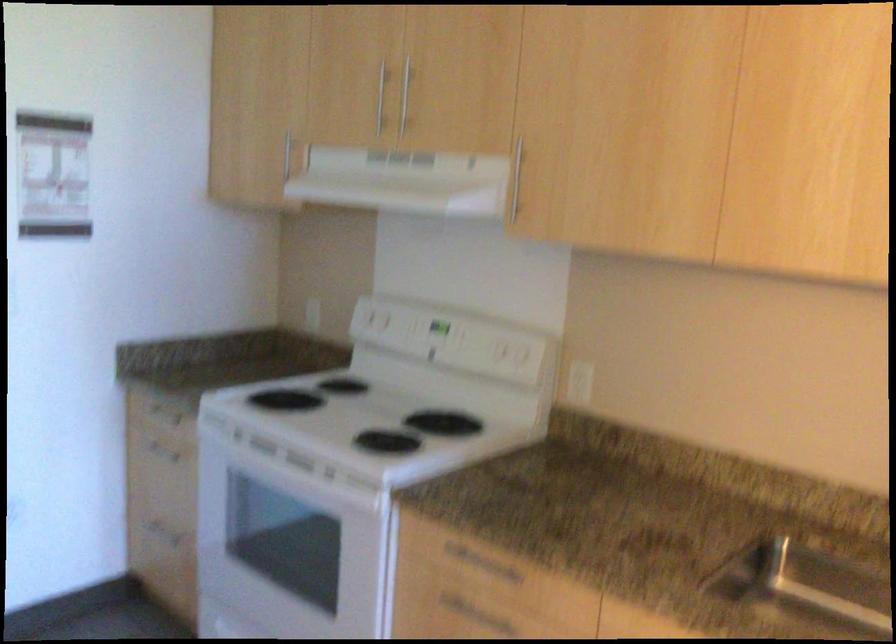
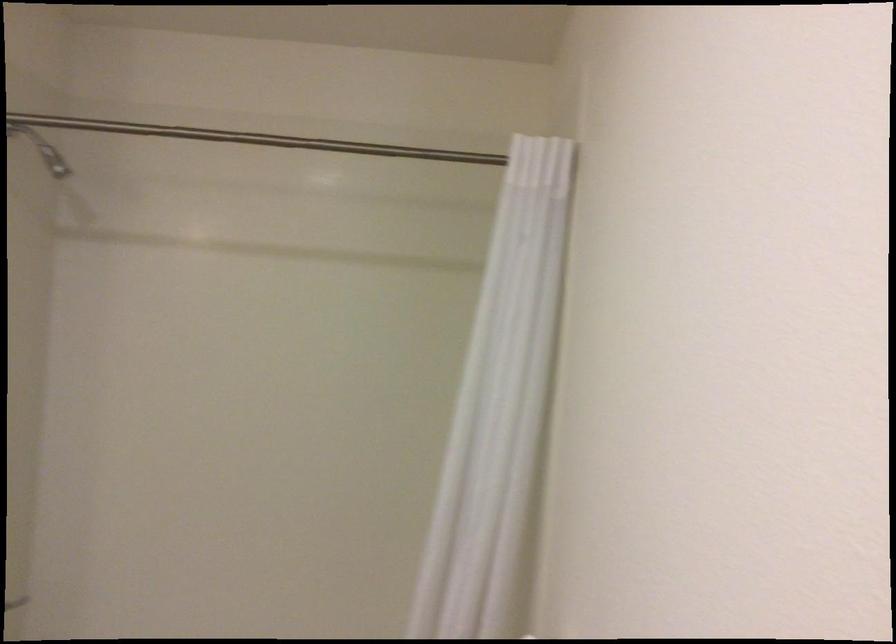
Question: The images are taken continuously from a first-person perspective. In which direction is your viewpoint rotating?

Choices:
 (A) Left
 (B) Right
 (C) Up
 (D) Down

Answer: (A)